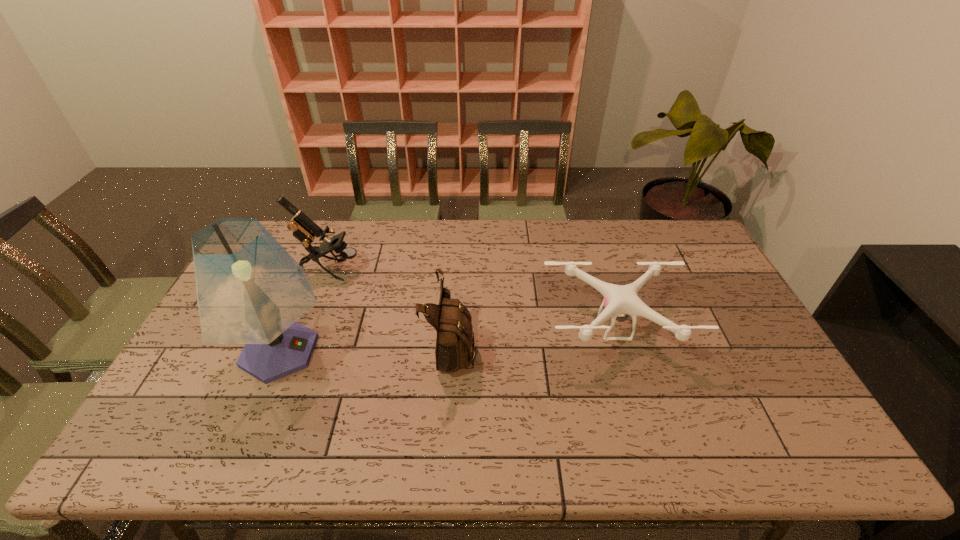
The image size is (960, 540). I want to click on object present at the far edge, so click(304, 229).

This screenshot has height=540, width=960. I want to click on object that is at the left edge, so pos(250,290).

In the image, there is a desktop. At what (x,y) coordinates should I click in order to perform the action: click on free region at the far edge. Please return your answer as a coordinate pair (x, y). Image resolution: width=960 pixels, height=540 pixels. Looking at the image, I should click on (306, 253).

I want to click on vacant space at the near edge of the desktop, so click(208, 449).

The image size is (960, 540). Identify the location of free spot at the right edge of the desktop. (770, 414).

Find the location of a particular element. The width and height of the screenshot is (960, 540). free spot between the microscope and the shortest object is located at coordinates (472, 299).

Identify the location of free area in between the shoulder bag and the farthest object. (391, 308).

This screenshot has width=960, height=540. In order to click on vacant area that lies between the shoulder bag and the microscope in this screenshot , I will do `click(391, 308)`.

Where is `vacant region between the microscope and the second shortest object`? The height and width of the screenshot is (540, 960). vacant region between the microscope and the second shortest object is located at coordinates (391, 308).

The image size is (960, 540). In order to click on vacant space that is in between the shortest object and the second shortest object in this screenshot , I will do `click(533, 337)`.